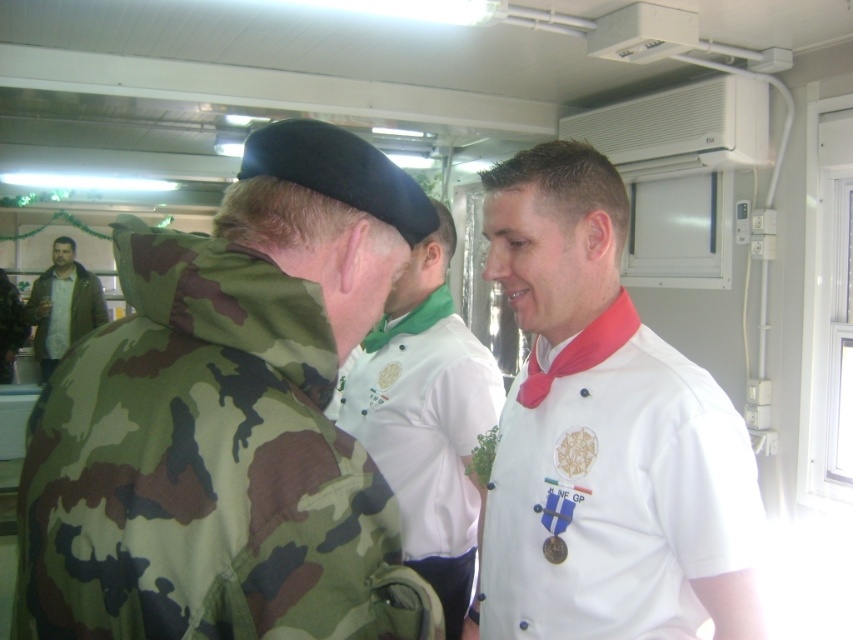
Question: Does camo fabric jacket at left appear on the left side of white matte chef's coat at center?

Choices:
 (A) yes
 (B) no

Answer: (A)

Question: Is camo fabric jacket at left in front of white matte chef's coat at center?

Choices:
 (A) no
 (B) yes

Answer: (B)

Question: Estimate the real-world distances between objects in this image. Which object is closer to the camouflage fabric jacket at left?

Choices:
 (A) white matte chef's coat at center
 (B) brown leather jacket at left
 (C) white glossy shirt at center
 (D) camo fabric jacket at left

Answer: (B)

Question: Is the position of camo fabric jacket at left more distant than that of camouflage fabric jacket at left?

Choices:
 (A) yes
 (B) no

Answer: (B)

Question: Which object is positioned closest to the camo fabric jacket at left?

Choices:
 (A) brown leather jacket at left
 (B) white glossy shirt at center

Answer: (B)

Question: Which point is closer to the camera taking this photo?

Choices:
 (A) click(x=306, y=609)
 (B) click(x=0, y=364)
 (C) click(x=48, y=314)

Answer: (A)